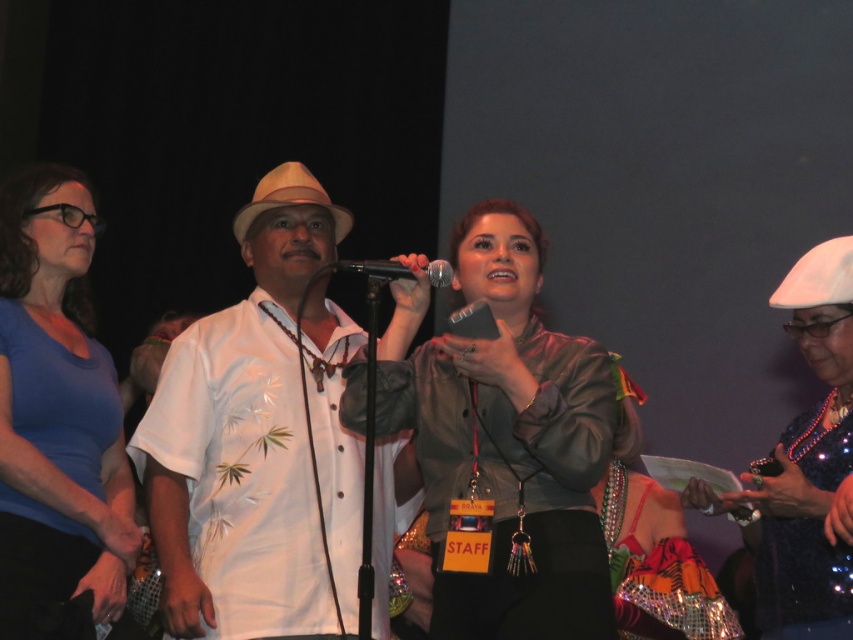
You are standing in the center of the room and want to hand a microphone to the person wearing the blue matte shirt at left. In which direction should you move to reach them?

The blue matte shirt at left is located at point 0.642 on the x and 0.067 on the y axis. Since you are in the center, you should move towards the left and slightly forward to reach them.

You are at a social event and see the white matte shirt at center and the shiny metallic jacket at center. Which one is positioned to the left?

The white matte shirt at center is positioned to the left of the shiny metallic jacket at center.

You are an event organizer trying to adjust the lighting for a stage performance. You notice the white matte shirt at center and the shiny metallic jacket at center. Which object should you focus the spotlight on to ensure it reflects light the most effectively?

The shiny metallic jacket at center should be the focus of the spotlight because it reflects light more effectively than the white matte shirt at center.